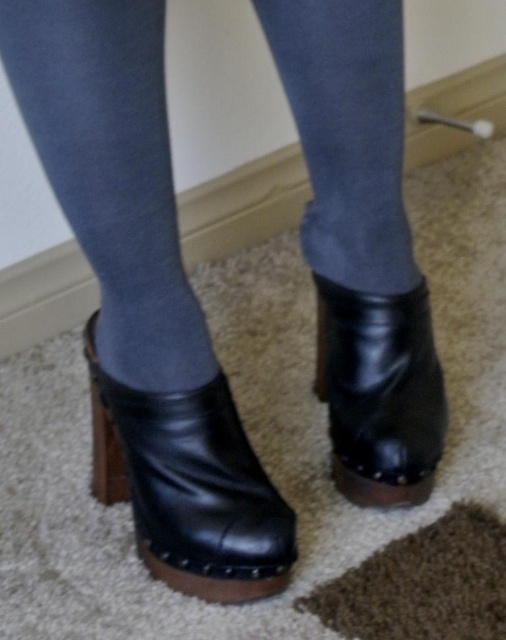
I want to click on denim jeans at center, so [x=111, y=172].

Who is lower down, denim jeans at center or black leather boot at lower left?

Positioned lower is black leather boot at lower left.

What do you see at coordinates (111, 172) in the screenshot? I see `denim jeans at center` at bounding box center [111, 172].

Where is `denim jeans at center`? denim jeans at center is located at coordinates (111, 172).

Measure the distance between point (217, 477) and camera.

They are 31.30 inches apart.

Locate an element on the screen. black leather boot at lower left is located at coordinates (189, 486).

You are a GUI agent. You are given a task and a screenshot of the screen. Output one action in this format:
    pyautogui.click(x=<x>, y=<y>)
    Task: Click on the black leather boot at lower left
    The height and width of the screenshot is (640, 506).
    Given the screenshot: What is the action you would take?
    pyautogui.click(x=189, y=486)

Which is behind, point (376, 138) or point (427, 484)?

Point (427, 484)

Which is in front, point (105, 113) or point (400, 499)?

Point (105, 113) is in front.

Is point (145, 198) more distant than point (393, 452)?

That is False.

What are the coordinates of `denim jeans at center` in the screenshot? It's located at (111, 172).